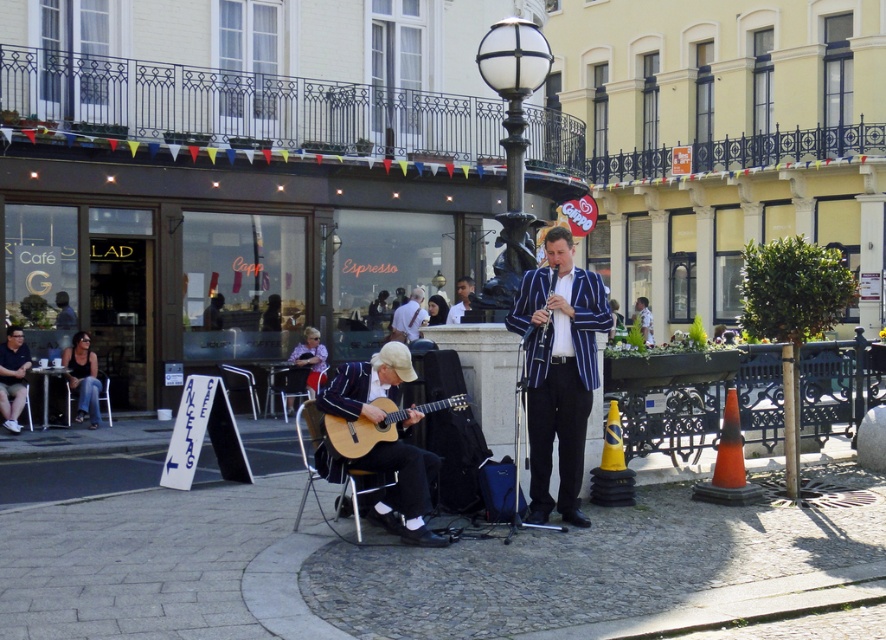
You are a street performer who wants to place your new 2.5 meters long banner between the wooden acoustic guitar at center and the white glass lamp post at upper center. Is there enough space between them to fit the banner without folding it?

The distance between the wooden acoustic guitar at center and the white glass lamp post at upper center is 2.17 meters. Since the banner is 2.5 meters long, it is longer than the available space. Therefore, the banner cannot be placed between them without folding.

You are a street performer who wants to place a small blue bag between the light brown wooden guitar at lower center and the denim jeans at lower left. Can you fit the bag there based on their sizes?

The light brown wooden guitar at lower center is not as tall as the denim jeans at lower left, so there might be enough space vertically to place the small blue bag between them.